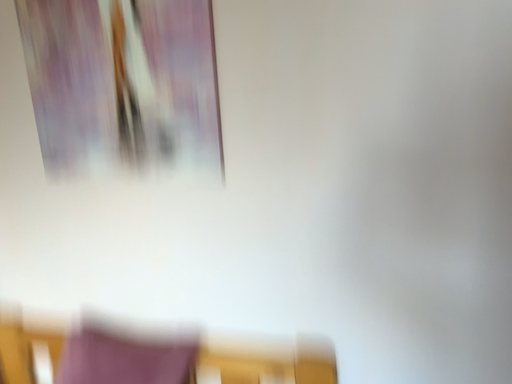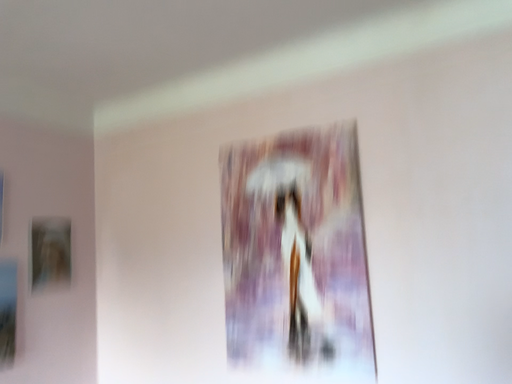
Question: How did the camera likely rotate when shooting the video?

Choices:
 (A) rotated right
 (B) rotated left

Answer: (B)